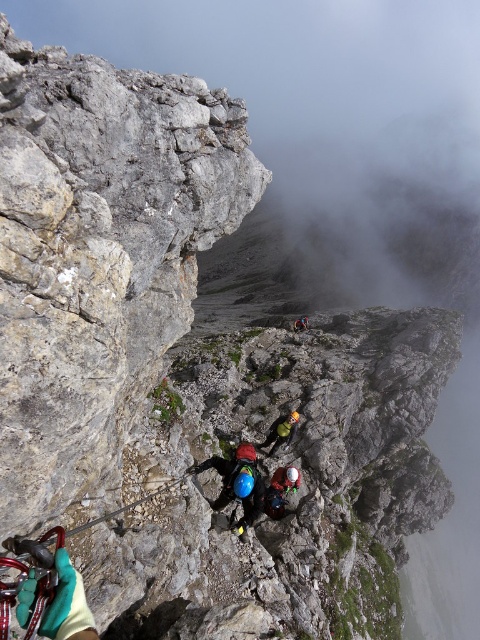
You are a drone operator tasked with capturing aerial footage of the climbers. Your drone has a maximum effective range of 25 meters. If you want to film the green fabric helmet at center, will your drone be able to reach it?

The green fabric helmet at center is 24.40 meters away from the camera. Since the drone can reach up to 25 meters, it will be able to capture the green fabric helmet at center within its effective range.

You are a climber looking at the mountain face. You see a matte blue helmet at center and a red helmet at center. Which helmet is positioned to the left?

The matte blue helmet at center is positioned to the left of the red helmet at center.